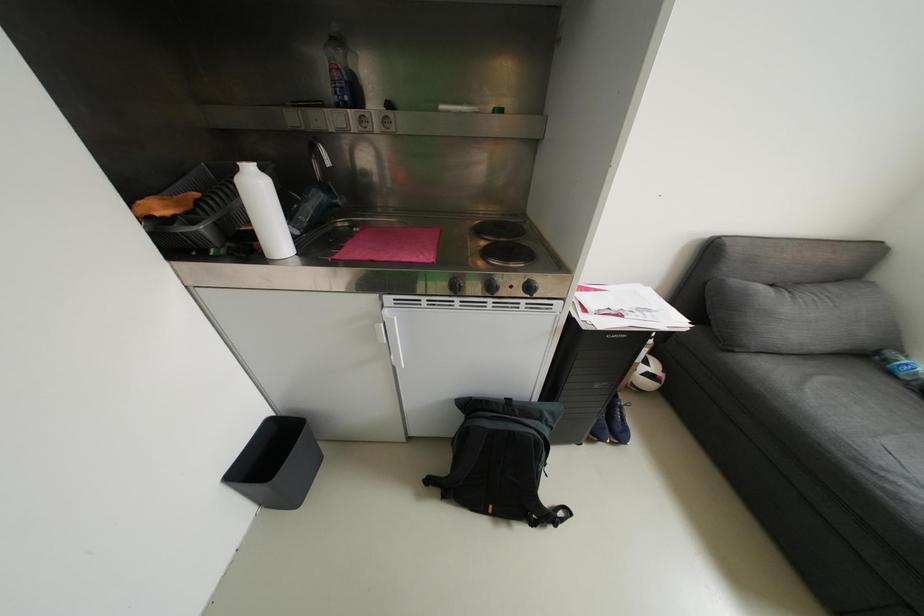
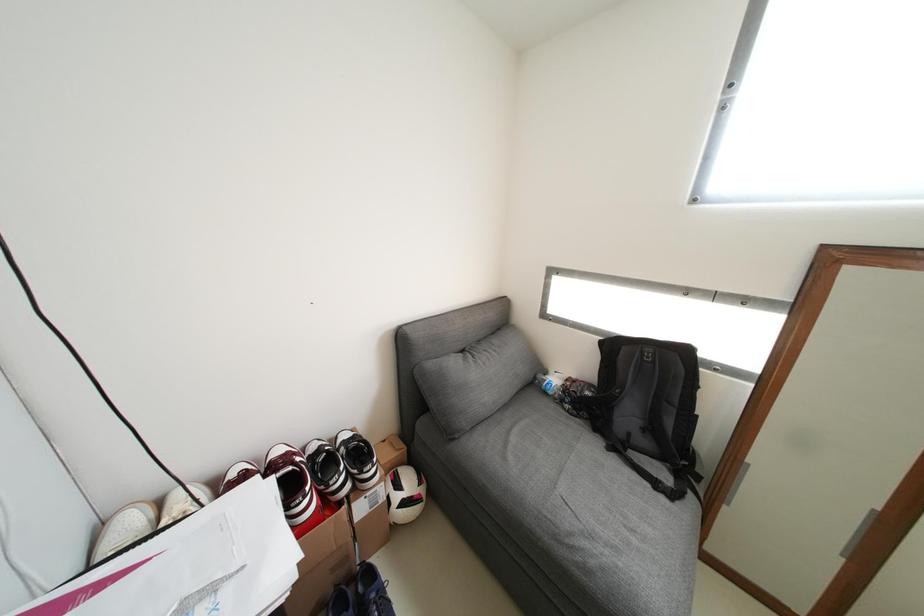
Question: The camera is either moving clockwise (left) or counter-clockwise (right) around the object. The first image is from the beginning of the video and the second image is from the end. Is the camera moving left or right when shooting the video?

Choices:
 (A) Left
 (B) Right

Answer: (A)